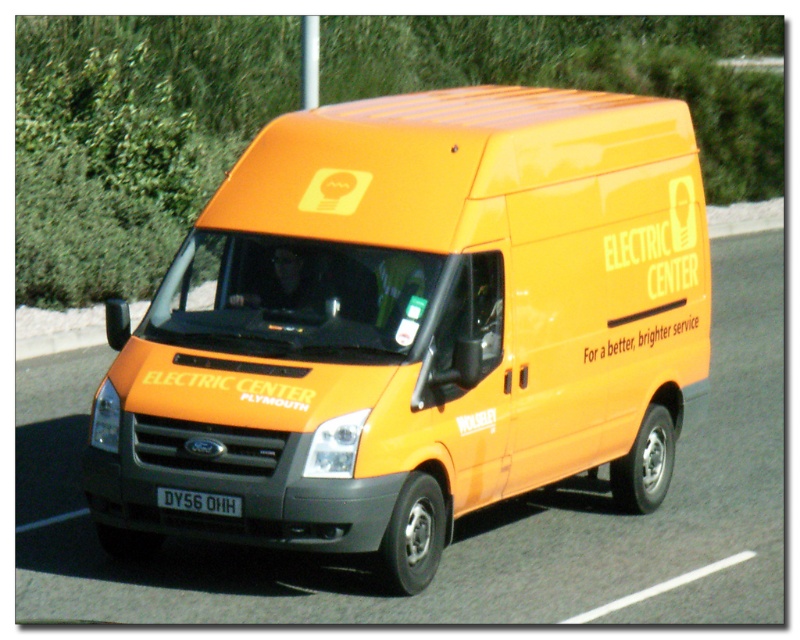
What is the color of the object located at point coordinates (414, 324)?

The point at coordinates (414, 324) is on the orange matte van at center, so the color is orange.

You are a delivery driver who needs to check the license plate number of the orange matte van at center before proceeding. Can you easily see the black plastic license plate at center from your current position in the van?

The orange matte van at center is located above the black plastic license plate at center, so you can easily see the black plastic license plate at center from your current position in the van.

What is the relationship between the height of the orange matte van at center and the black plastic license plate at center?

The orange matte van at center is much taller than the black plastic license plate at center.